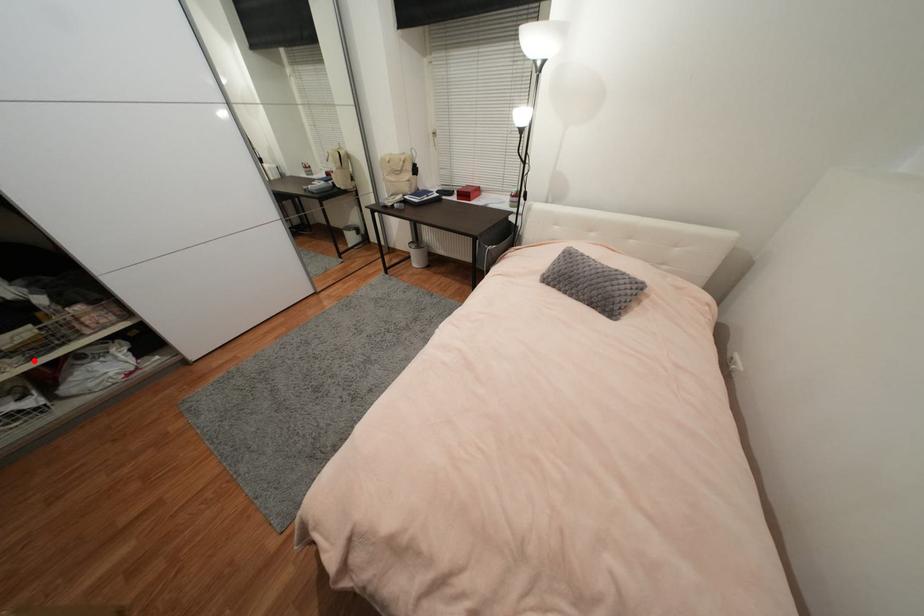
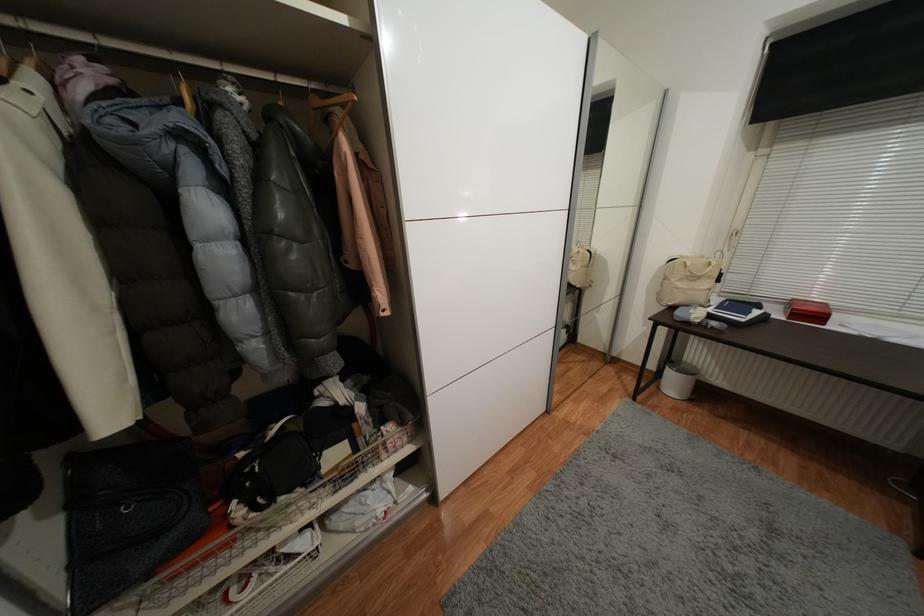
Where in the second image is the point corresponding to the highlighted location from the first image?

(342, 493)